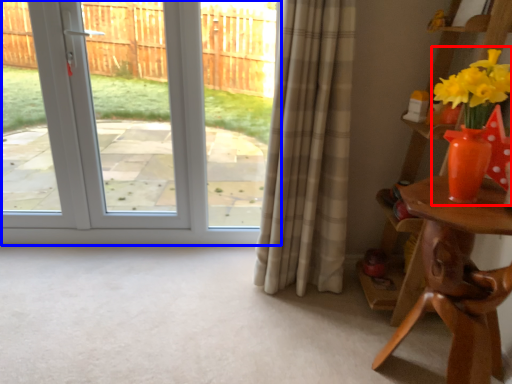
Question: Which of the following is the closest to the observer, floral arrangement (highlighted by a red box) or door (highlighted by a blue box)?

Choices:
 (A) floral arrangement
 (B) door

Answer: (A)